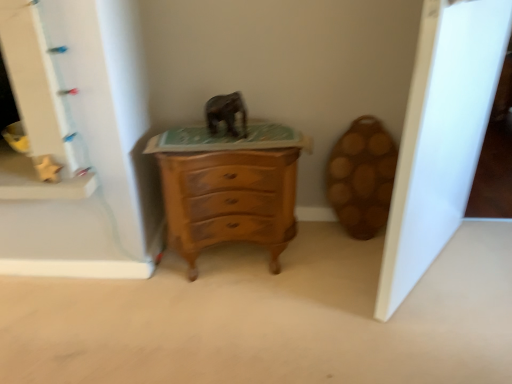
Image resolution: width=512 pixels, height=384 pixels. Find the location of `free space on the front side of white glossy door at right`. free space on the front side of white glossy door at right is located at coordinates (439, 323).